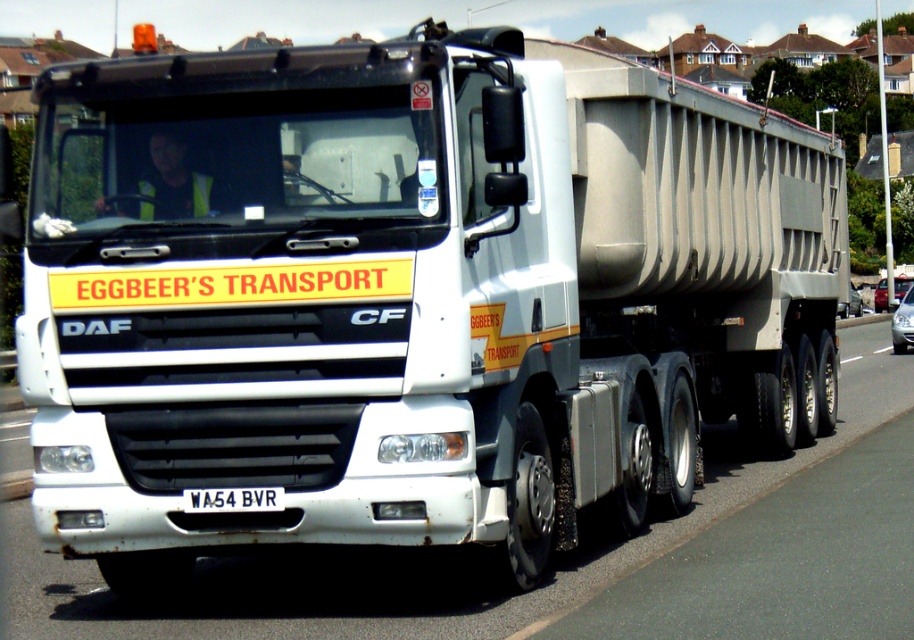
Question: Estimate the real-world distances between objects in this image. Which object is closer to the white plastic license plate at center?

Choices:
 (A) metallic silver car at right
 (B) white rubber line at road center

Answer: (B)

Question: Which of the following is the closest to the observer?

Choices:
 (A) (898, 326)
 (B) (874, 352)
 (C) (898, 289)
 (D) (229, 490)

Answer: (D)

Question: Is white plastic license plate at center to the right of satin silver sedan at center from the viewer's perspective?

Choices:
 (A) no
 (B) yes

Answer: (A)

Question: Is white plastic license plate at center in front of metallic silver car at right?

Choices:
 (A) yes
 (B) no

Answer: (A)

Question: Which object appears farthest from the camera in this image?

Choices:
 (A) white rubber line at road center
 (B) metallic silver car at right
 (C) white plastic license plate at center

Answer: (B)

Question: Does satin silver sedan at center come behind metallic silver car at right?

Choices:
 (A) yes
 (B) no

Answer: (B)